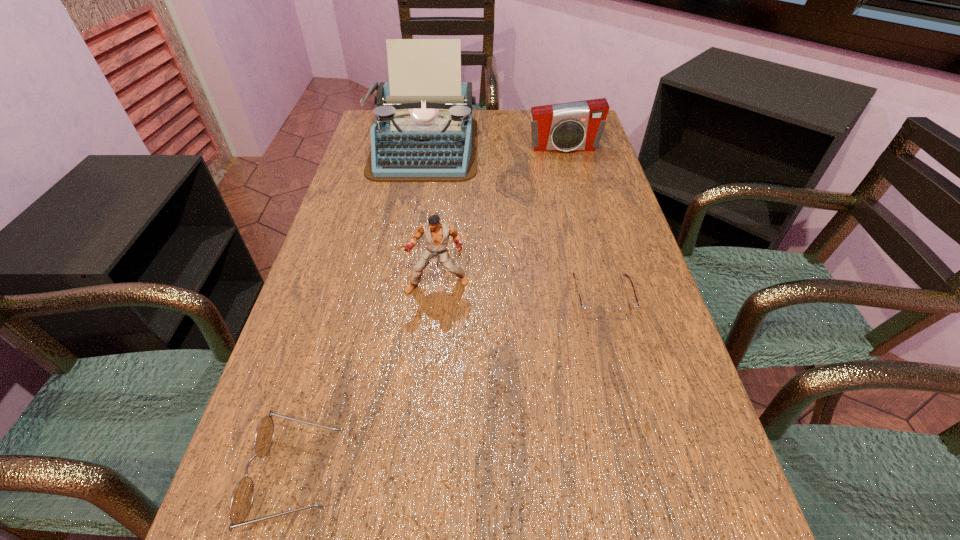
At what (x,y) coordinates should I click in order to perform the action: click on unoccupied position between the shortest object and the puncher. Please return your answer as a coordinate pair (x, y). The image size is (960, 540). Looking at the image, I should click on (519, 292).

You are a GUI agent. You are given a task and a screenshot of the screen. Output one action in this format:
    pyautogui.click(x=<x>, y=<y>)
    Task: Click on the free space between the nearer spectacles and the third shortest object
    This screenshot has width=960, height=540.
    Given the screenshot: What is the action you would take?
    pyautogui.click(x=430, y=312)

The image size is (960, 540). Identify the location of free space between the third shortest object and the typewriter. (493, 147).

Locate an element on the screen. The image size is (960, 540). object identified as the third closest to the taller spectacles is located at coordinates (424, 131).

This screenshot has height=540, width=960. I want to click on object that is the closest one to the second tallest object, so click(593, 313).

Find the location of a particular element. This screenshot has height=540, width=960. free space that satisfies the following two spatial constraints: 1. on the front-facing side of the third shortest object; 2. on the front-facing side of the second shortest object is located at coordinates coord(647,475).

Locate an element on the screen. vacant position in the image that satisfies the following two spatial constraints: 1. on the front-facing side of the shorter spectacles; 2. on the front-facing side of the nearer spectacles is located at coordinates (647, 475).

Image resolution: width=960 pixels, height=540 pixels. I want to click on vacant space that satisfies the following two spatial constraints: 1. on the front-facing side of the camera; 2. on the front-facing side of the nearest object, so click(647, 475).